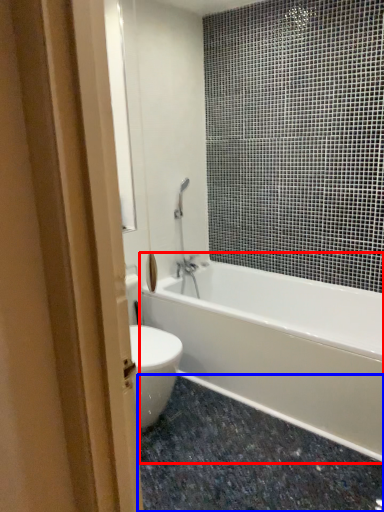
Question: Which of the following is the closest to the observer, bathtub (highlighted by a red box) or granite (highlighted by a blue box)?

Choices:
 (A) bathtub
 (B) granite

Answer: (B)